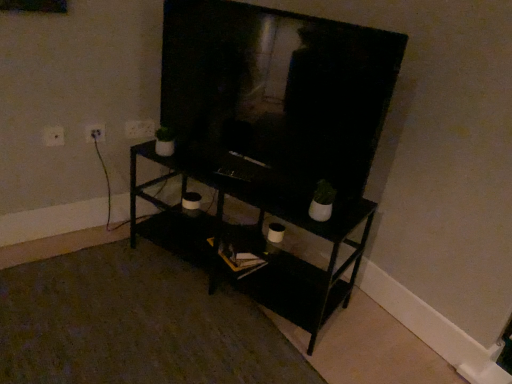
Question: From the image's perspective, is white plastic electric outlet at upper left, the 1th electric outlet when ordered from left to right, over white plastic electric outlet at upper left, acting as the 2th electric outlet starting from the front?

Choices:
 (A) no
 (B) yes

Answer: (A)

Question: Considering the relative sizes of white plastic electric outlet at upper left, the 1th electric outlet when ordered from left to right, and white plastic electric outlet at upper left, the second electric outlet positioned from the left, in the image provided, is white plastic electric outlet at upper left, the 1th electric outlet when ordered from left to right, smaller than white plastic electric outlet at upper left, the second electric outlet positioned from the left,?

Choices:
 (A) no
 (B) yes

Answer: (A)

Question: Is white plastic electric outlet at upper left, the 1th electric outlet when ordered from left to right, far from white plastic electric outlet at upper left, which is counted as the 2th electric outlet, starting from the back?

Choices:
 (A) yes
 (B) no

Answer: (B)

Question: Is white plastic electric outlet at upper left, acting as the 2th electric outlet starting from the front, at the back of white plastic electric outlet at upper left, which ranks as the first electric outlet in front-to-back order?

Choices:
 (A) no
 (B) yes

Answer: (A)

Question: From a real-world perspective, is white plastic electric outlet at upper left, which ranks as the first electric outlet in front-to-back order, located higher than white plastic electric outlet at upper left, the 2th electric outlet when ordered from right to left?

Choices:
 (A) no
 (B) yes

Answer: (B)

Question: Is white plastic electric outlet at upper left, the 1th electric outlet when ordered from left to right, next to white plastic electric outlet at upper left, which is counted as the 2th electric outlet, starting from the back, and touching it?

Choices:
 (A) yes
 (B) no

Answer: (B)

Question: Is white plastic electric outlet at upper left, the 3th electric outlet when ordered from back to front, touching white plastic electric outlet at upper left, the third electric outlet when ordered from front to back?

Choices:
 (A) yes
 (B) no

Answer: (B)

Question: Is white plastic electric outlet at upper left, the 3th electric outlet when ordered from back to front, oriented away from white plastic electric outlet at upper left, the third electric outlet when ordered from front to back?

Choices:
 (A) yes
 (B) no

Answer: (B)

Question: Considering the relative sizes of white plastic electric outlet at upper left, the 3th electric outlet when ordered from back to front, and white plastic electric outlet at upper left, the third electric outlet positioned from the left, in the image provided, is white plastic electric outlet at upper left, the 3th electric outlet when ordered from back to front, bigger than white plastic electric outlet at upper left, the third electric outlet positioned from the left,?

Choices:
 (A) no
 (B) yes

Answer: (A)

Question: Can you confirm if white plastic electric outlet at upper left, the 1th electric outlet when ordered from left to right, is positioned to the right of white plastic electric outlet at upper left, the third electric outlet when ordered from front to back?

Choices:
 (A) yes
 (B) no

Answer: (B)

Question: Is white plastic electric outlet at upper left, the 1th electric outlet when ordered from left to right, taller than white plastic electric outlet at upper left, which is counted as the first electric outlet, starting from the back?

Choices:
 (A) yes
 (B) no

Answer: (B)

Question: Considering the relative sizes of white plastic electric outlet at upper left, the 1th electric outlet when ordered from left to right, and white plastic electric outlet at upper left, the 1th electric outlet from the right, in the image provided, is white plastic electric outlet at upper left, the 1th electric outlet when ordered from left to right, thinner than white plastic electric outlet at upper left, the 1th electric outlet from the right,?

Choices:
 (A) yes
 (B) no

Answer: (B)

Question: Is white plastic electric outlet at upper left, which is counted as the first electric outlet, starting from the back, not within white plastic electric outlet at upper left, the 2th electric outlet when ordered from right to left?

Choices:
 (A) yes
 (B) no

Answer: (A)